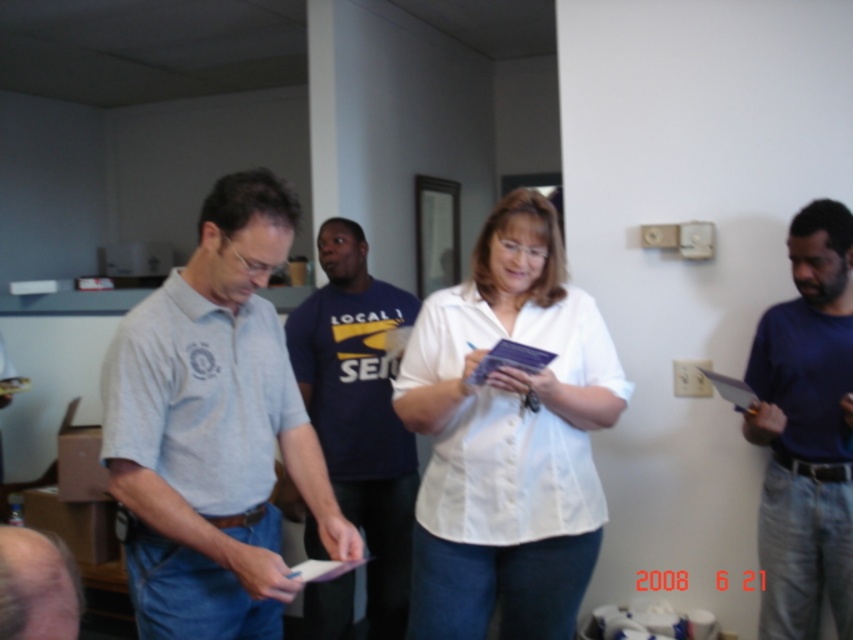
Question: Among these points, which one is farthest from the camera?

Choices:
 (A) (67, 600)
 (B) (329, 616)
 (C) (784, 429)
 (D) (148, 387)

Answer: (B)

Question: Which point appears closest to the camera in this image?

Choices:
 (A) (352, 314)
 (B) (801, 268)
 (C) (277, 225)

Answer: (C)

Question: Can you confirm if blue cotton shirt at right is smaller than smooth skin head at lower left?

Choices:
 (A) no
 (B) yes

Answer: (A)

Question: Can you confirm if light gray cotton shirt at center is wider than white matte shirt at center?

Choices:
 (A) no
 (B) yes

Answer: (A)

Question: Does light gray cotton shirt at center have a greater width compared to blue cotton shirt at right?

Choices:
 (A) yes
 (B) no

Answer: (A)

Question: Which of the following is the farthest from the observer?

Choices:
 (A) light gray shirt at center
 (B) blue cotton shirt at right
 (C) light gray cotton shirt at center
 (D) smooth skin head at lower left

Answer: (A)